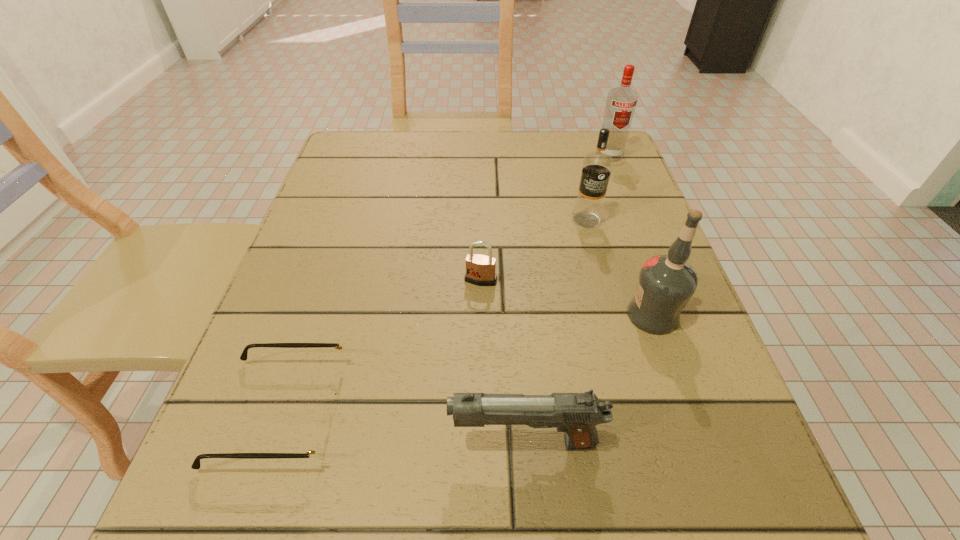
Image resolution: width=960 pixels, height=540 pixels. Find the location of `object that is at the far right corner`. object that is at the far right corner is located at coordinates (621, 103).

You are a GUI agent. You are given a task and a screenshot of the screen. Output one action in this format:
    pyautogui.click(x=<x>, y=<y>)
    Task: Click on the blank space at the far edge of the desktop
    
    Given the screenshot: What is the action you would take?
    pyautogui.click(x=510, y=144)

In the image, there is a desktop. Where is `vacant space at the near edge`? The width and height of the screenshot is (960, 540). vacant space at the near edge is located at coordinates click(x=616, y=497).

This screenshot has width=960, height=540. Find the location of `free space at the left edge`. free space at the left edge is located at coordinates (339, 230).

I want to click on free space at the right edge of the desktop, so click(760, 473).

Where is `free spot at the far left corner of the desktop`? The height and width of the screenshot is (540, 960). free spot at the far left corner of the desktop is located at coordinates (395, 157).

This screenshot has width=960, height=540. In the image, there is a desktop. In order to click on vacant region at the near left corner in this screenshot , I will do `click(219, 513)`.

You are a GUI agent. You are given a task and a screenshot of the screen. Output one action in this format:
    pyautogui.click(x=<x>, y=<y>)
    Task: Click on the vacant region at the far right corner of the desktop
    
    Given the screenshot: What is the action you would take?
    pyautogui.click(x=582, y=149)

What are the coordinates of `free space between the fourth nearest object and the nearest vodka` in the screenshot? It's located at (566, 298).

Locate an element on the screen. This screenshot has width=960, height=540. vacant space that's between the second farthest vodka and the second shortest object is located at coordinates (534, 250).